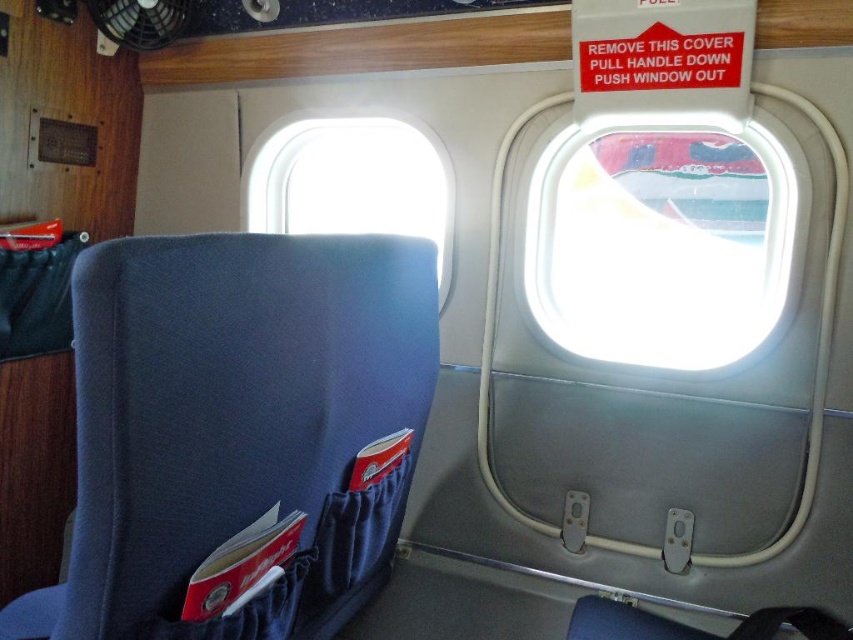
Question: Is transparent plastic airplane window at upper right below blue fabric airplane window at upper center?

Choices:
 (A) no
 (B) yes

Answer: (B)

Question: Among these objects, which one is farthest from the camera?

Choices:
 (A) transparent plastic airplane window at upper right
 (B) blue fabric airplane window at upper center

Answer: (B)

Question: Is transparent plastic airplane window at upper right thinner than blue fabric airplane window at upper center?

Choices:
 (A) yes
 (B) no

Answer: (B)

Question: Can you confirm if transparent plastic airplane window at upper right is positioned above blue fabric airplane window at upper center?

Choices:
 (A) yes
 (B) no

Answer: (B)

Question: Which object appears closest to the camera in this image?

Choices:
 (A) blue fabric airplane window at upper center
 (B) transparent plastic airplane window at upper right

Answer: (B)